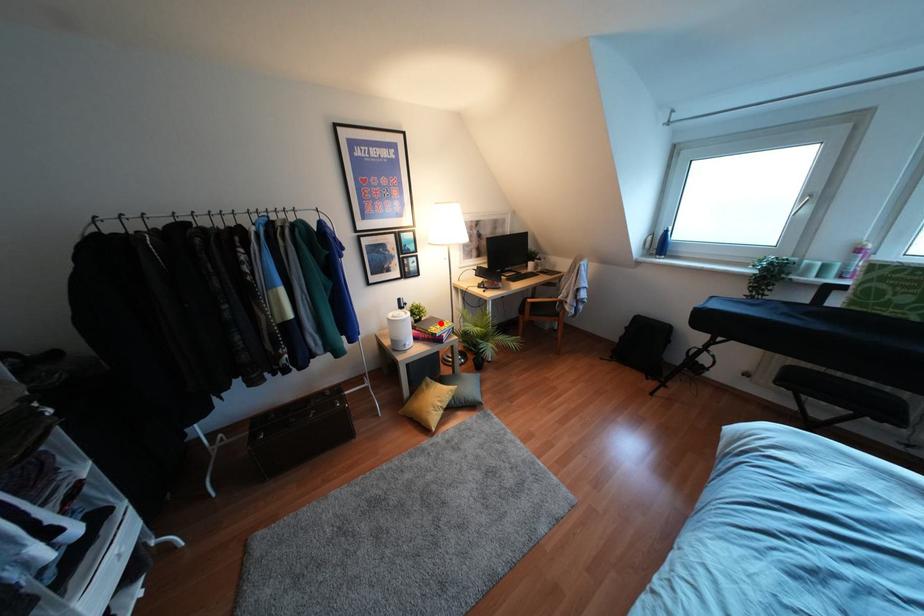
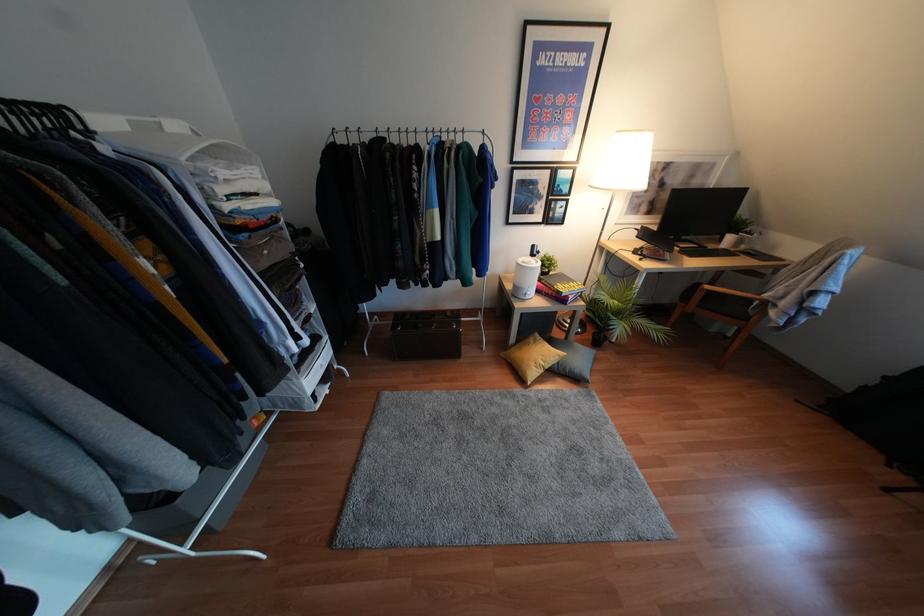
In the second image, find the point that corresponds to the highlighted location in the first image.

(570, 283)